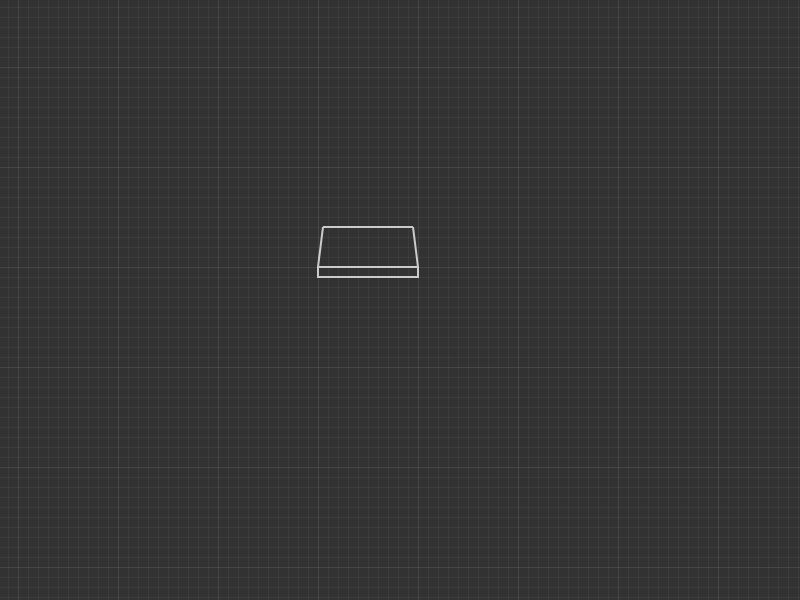
At what (x,y) coordinates should I click in order to perform the action: click on book. Please return your answer as a coordinate pair (x, y). This screenshot has height=600, width=800. Looking at the image, I should click on (358, 275).